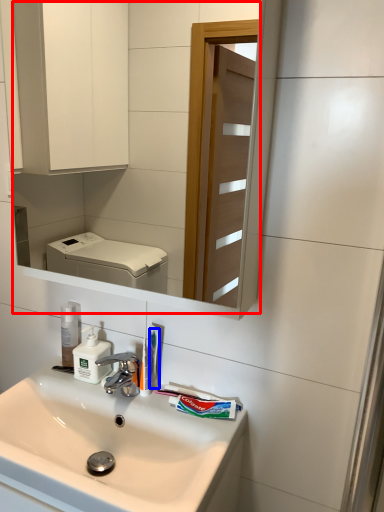
Question: Which of the following is the farthest to the observer, mirror (highlighted by a red box) or toothbrush (highlighted by a blue box)?

Choices:
 (A) mirror
 (B) toothbrush

Answer: (B)